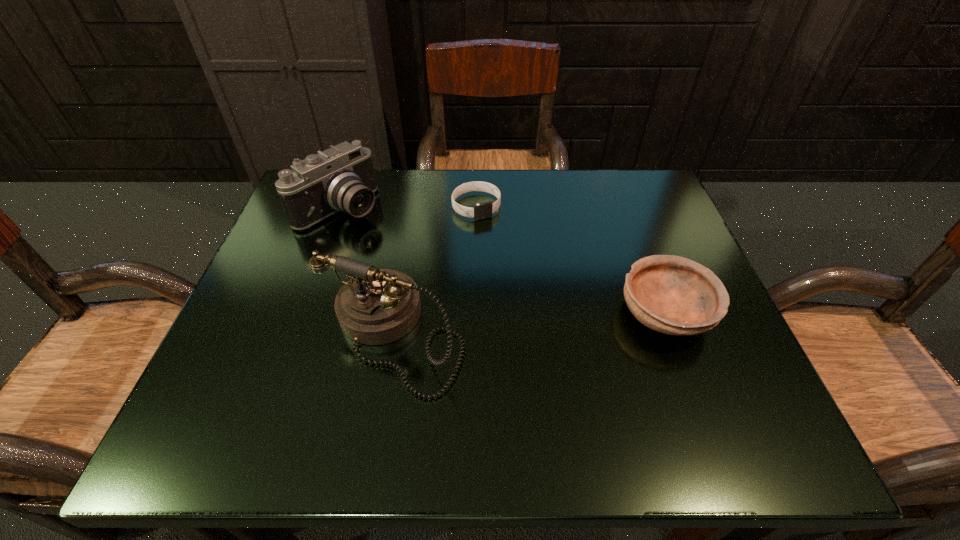
This screenshot has height=540, width=960. I want to click on free spot located on the outer surface of the shortest object, so click(516, 276).

The width and height of the screenshot is (960, 540). In order to click on vacant space located 0.270m on the outer surface of the shortest object in this screenshot , I will do `click(533, 305)`.

You are a GUI agent. You are given a task and a screenshot of the screen. Output one action in this format:
    pyautogui.click(x=<x>, y=<y>)
    Task: Click on the vacant point located 0.180m on the outer surface of the shortest object
    Image resolution: width=960 pixels, height=540 pixels.
    Given the screenshot: What is the action you would take?
    pyautogui.click(x=515, y=273)

At what (x,y) coordinates should I click in order to perform the action: click on camera that is at the far edge. Please return your answer as a coordinate pair (x, y). This screenshot has height=540, width=960. Looking at the image, I should click on (342, 178).

Locate an element on the screen. Image resolution: width=960 pixels, height=540 pixels. wristband situated at the far edge is located at coordinates (480, 211).

Image resolution: width=960 pixels, height=540 pixels. Find the location of `object located at the near edge`. object located at the near edge is located at coordinates (376, 306).

What are the coordinates of `telephone that is at the left edge` in the screenshot? It's located at (376, 306).

Image resolution: width=960 pixels, height=540 pixels. In order to click on camera that is at the left edge in this screenshot , I will do `click(342, 178)`.

Locate an element on the screen. This screenshot has width=960, height=540. object at the right edge is located at coordinates (673, 295).

The height and width of the screenshot is (540, 960). I want to click on object at the far left corner, so click(342, 178).